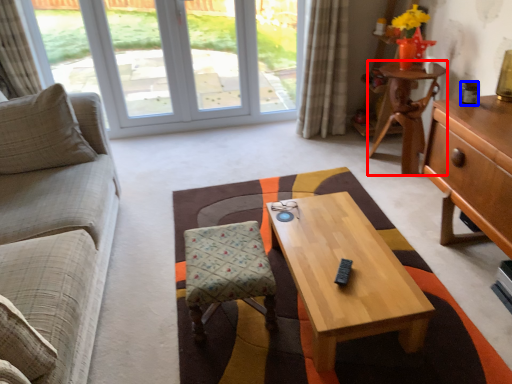
Question: Which of the following is the farthest to the observer, desk (highlighted by a red box) or coffee cup (highlighted by a blue box)?

Choices:
 (A) desk
 (B) coffee cup

Answer: (A)